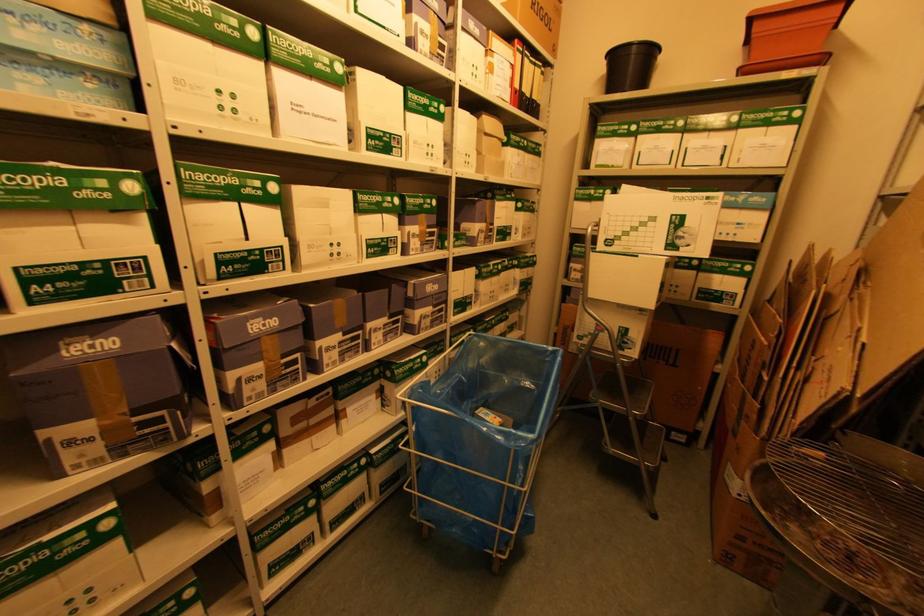
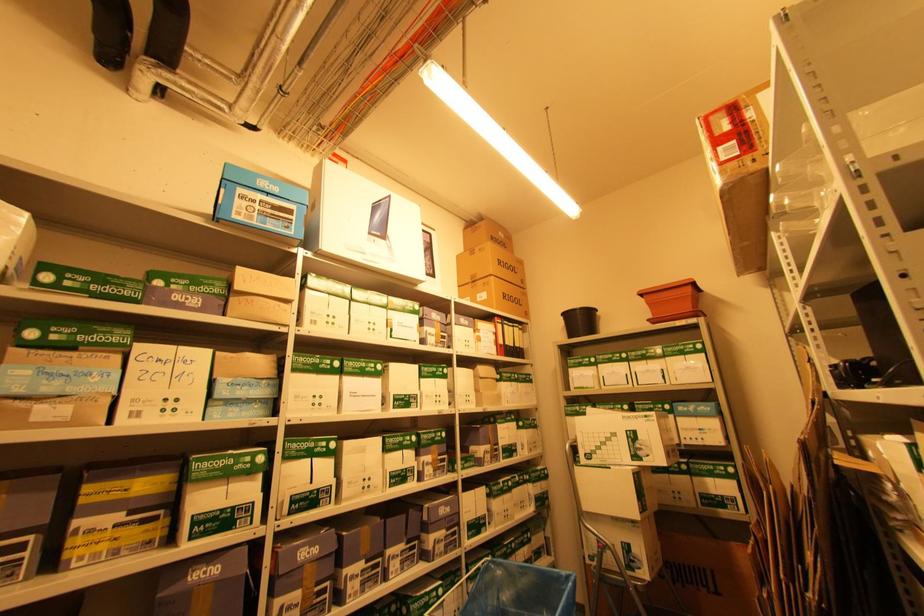
Question: The first image is from the beginning of the video and the second image is from the end. How did the camera likely rotate when shooting the video?

Choices:
 (A) Left
 (B) Right
 (C) Up
 (D) Down

Answer: (C)